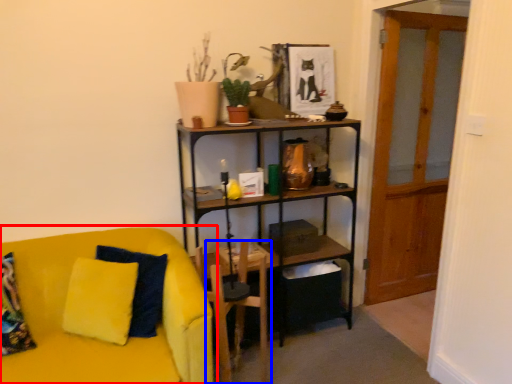
Question: Which of the following is the farthest to the observer, studio couch (highlighted by a red box) or armchair (highlighted by a blue box)?

Choices:
 (A) studio couch
 (B) armchair

Answer: (B)